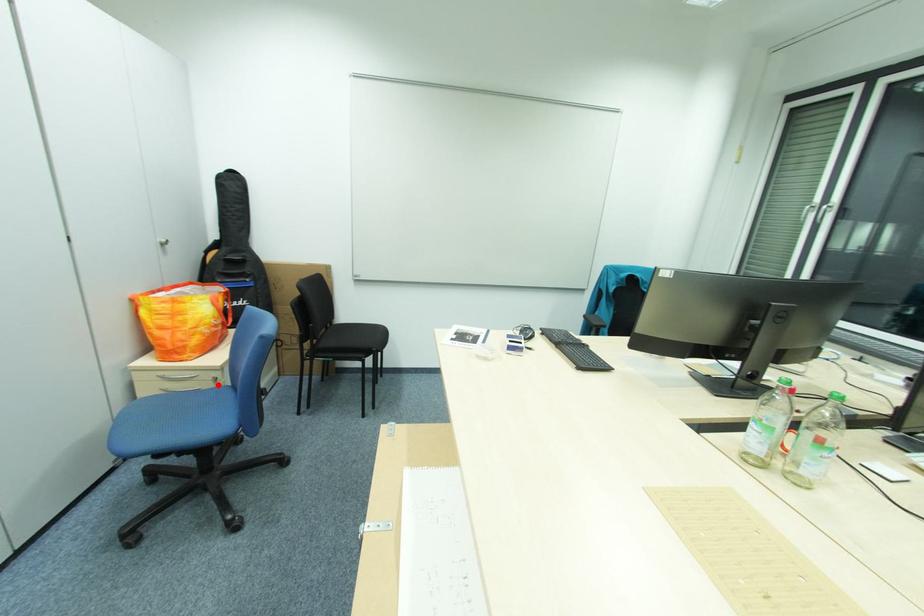
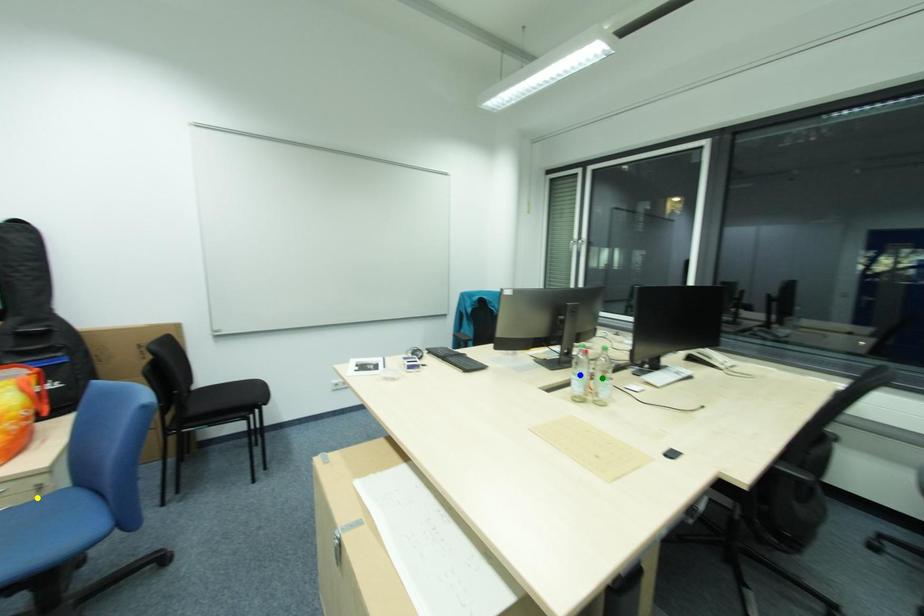
Question: I am providing you with two images of the same scene from different viewpoints. A red point is marked on the first image. You are given multiple points on the second image. Which mark in image 2 goes with the point in image 1?

Choices:
 (A) blue point
 (B) green point
 (C) yellow point

Answer: (C)